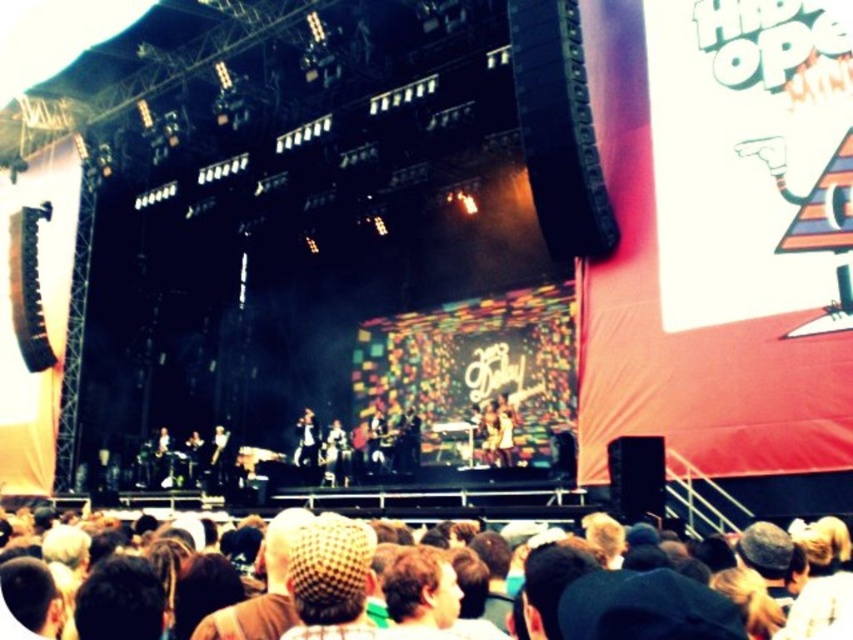
Is brown hair at center thinner than shiny silver guitar at center?

Yes, brown hair at center is thinner than shiny silver guitar at center.

Who is more forward, (425, 616) or (337, 458)?

Positioned in front is point (425, 616).

Identify the location of brown hair at center. [x=421, y=595].

What do you see at coordinates (421, 595) in the screenshot? I see `brown hair at center` at bounding box center [421, 595].

You are a GUI agent. You are given a task and a screenshot of the screen. Output one action in this format:
    pyautogui.click(x=<x>, y=<y>)
    Task: Click on the brown hair at center
    The height and width of the screenshot is (640, 853).
    Given the screenshot: What is the action you would take?
    pyautogui.click(x=421, y=595)

Is point (422, 577) less distant than point (302, 470)?

Yes, it is.

The width and height of the screenshot is (853, 640). I want to click on brown hair at center, so click(x=421, y=595).

Between point (302, 435) and point (405, 432), which one is positioned in front?

Point (405, 432) is in front.

Does black leather jacket at center appear on the left side of shiny black microphone at center?

Yes, black leather jacket at center is to the left of shiny black microphone at center.

You are a GUI agent. You are given a task and a screenshot of the screen. Output one action in this format:
    pyautogui.click(x=<x>, y=<y>)
    Task: Click on the black leather jacket at center
    The image size is (853, 640).
    Given the screenshot: What is the action you would take?
    pyautogui.click(x=306, y=444)